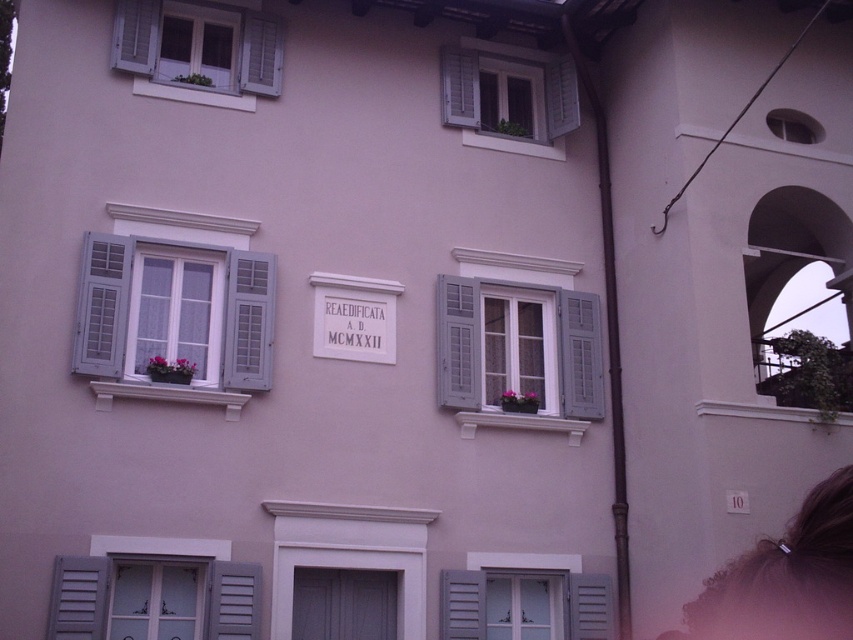
Is matte gray shutters at left smaller than matte white flower box at lower left?

Incorrect, matte gray shutters at left is not smaller in size than matte white flower box at lower left.

Is matte gray shutters at left in front of matte white flower box at lower left?

Yes.

Which is in front, point (164, 289) or point (161, 380)?

Point (161, 380)

The image size is (853, 640). Identify the location of matte gray shutters at left. (173, 312).

Describe the element at coordinates (154, 598) in the screenshot. I see `matte gray shutters at lower left` at that location.

Can you confirm if matte gray shutters at lower left is positioned to the right of white painted wood window at upper left?

Indeed, matte gray shutters at lower left is positioned on the right side of white painted wood window at upper left.

I want to click on matte gray shutters at lower left, so click(x=154, y=598).

Who is more distant from viewer, (90, 582) or (183, 380)?

The point (183, 380) is behind.

Is matte gray shutters at lower left taller than matte white flower box at lower left?

Yes.

Does point (136, 612) lie behind point (149, 371)?

No, it is not.

This screenshot has height=640, width=853. What are the coordinates of `matte gray shutters at lower left` in the screenshot? It's located at click(154, 598).